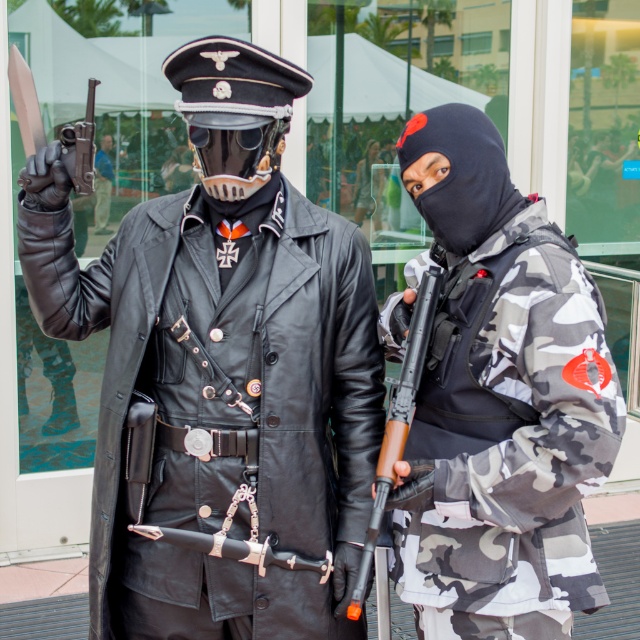
You are a character in the scene and need to access the wooden stock rifle at center. Can you reach it without moving the camo fabric jacket at right?

The camo fabric jacket at right is positioned over the wooden stock rifle at center, so you cannot reach the wooden stock rifle at center without moving the camo fabric jacket at right.

Looking at this image, you are a security guard observing the scene described. You notice the camo fabric jacket at right and the matte black pistol at left. Based on their positions, which object is closer to the bottom edge of the image?

The camo fabric jacket at right is located below the matte black pistol at left, so it is closer to the bottom edge of the image.

You are standing in front of the glass wall and want to locate the black leather coat at center. Which direction should you look to find it?

The black leather coat at center is located at point 0.634 on the x axis and 0.350 on the y axis, so you should look to the center of the image to find it.